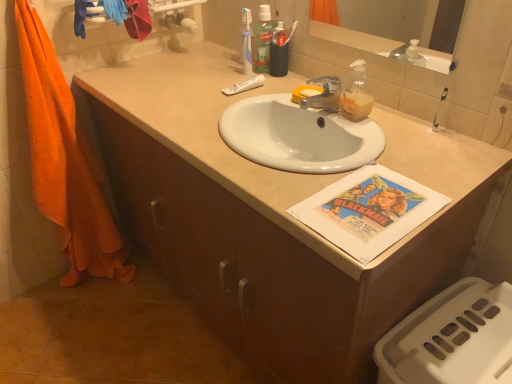
Where is `free point to the left of silver metallic faucet at center`? This screenshot has height=384, width=512. free point to the left of silver metallic faucet at center is located at coordinates (263, 100).